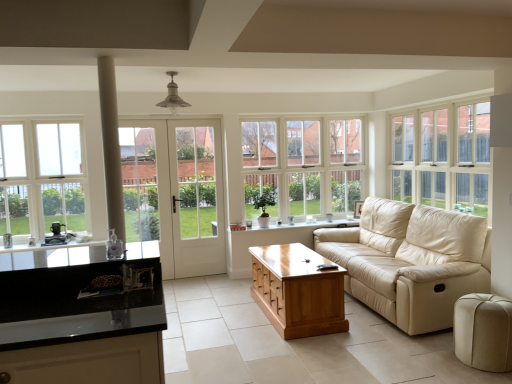
What do you see at coordinates (303, 166) in the screenshot?
I see `white wood window at center, which is the second window from left to right` at bounding box center [303, 166].

Describe the element at coordinates (483, 331) in the screenshot. I see `beige velvet ottoman at lower right` at that location.

The height and width of the screenshot is (384, 512). What do you see at coordinates (443, 157) in the screenshot?
I see `white wood window at upper right, arranged as the third window when viewed from the left` at bounding box center [443, 157].

Locate an element on the screen. This screenshot has height=384, width=512. white wood window at upper right, acting as the 1th window starting from the right is located at coordinates (443, 157).

This screenshot has height=384, width=512. Describe the element at coordinates (53, 257) in the screenshot. I see `black glossy countertop at lower left` at that location.

Locate an element on the screen. white wood window at center, placed as the 2th window when sorted from right to left is located at coordinates (303, 166).

Is beige leather couch at center at the left side of white wood window at center, placed as the 2th window when sorted from right to left?

In fact, beige leather couch at center is to the right of white wood window at center, placed as the 2th window when sorted from right to left.

Is beige leather couch at center positioned far away from white wood window at center, which is the second window from left to right?

Yes.

Which object is wider, beige leather couch at center or white wood window at center, placed as the 2th window when sorted from right to left?

Wider between the two is beige leather couch at center.

Can you tell me how much beige leather couch at center and white wood window at center, which is the second window from left to right, differ in facing direction?

There is a 89.5-degree angle between the facing directions of beige leather couch at center and white wood window at center, which is the second window from left to right.

Which is behind, black glossy countertop at lower left or white glass door at center?

Positioned behind is white glass door at center.

Consider the image. From a real-world perspective, is black glossy countertop at lower left on white glass door at center?

Incorrect, from a real-world perspective, black glossy countertop at lower left is lower than white glass door at center.

Is point (52, 256) closer to viewer compared to point (204, 228)?

That is True.

Looking at this image, considering the sizes of objects shiny brown wooden coffee table at center and black glossy countertop at lower left in the image provided, who is bigger, shiny brown wooden coffee table at center or black glossy countertop at lower left?

Bigger between the two is shiny brown wooden coffee table at center.

From a real-world perspective, relative to black glossy countertop at lower left, is shiny brown wooden coffee table at center vertically above or below?

In terms of real-world spatial position, shiny brown wooden coffee table at center is below black glossy countertop at lower left.

Which is correct: shiny brown wooden coffee table at center is inside black glossy countertop at lower left, or outside of it?

shiny brown wooden coffee table at center exists outside the volume of black glossy countertop at lower left.

Is shiny brown wooden coffee table at center shorter than black glossy countertop at lower left?

Incorrect, the height of shiny brown wooden coffee table at center does not fall short of that of black glossy countertop at lower left.

From the picture: From the image's perspective, is beige velvet ottoman at lower right positioned above or below beige leather couch at center?

beige velvet ottoman at lower right is situated lower than beige leather couch at center in the image.

Is beige velvet ottoman at lower right inside or outside of beige leather couch at center?

beige velvet ottoman at lower right is not enclosed by beige leather couch at center.

Is beige velvet ottoman at lower right with beige leather couch at center?

No.

Can you confirm if white glass door at center is positioned to the right of white wood window at center, which is the second window from left to right?

No, white glass door at center is not to the right of white wood window at center, which is the second window from left to right.

Would you say white wood window at center, which is the second window from left to right, is part of white glass door at center's contents?

No, white wood window at center, which is the second window from left to right, is not inside white glass door at center.

Can you confirm if white glass door at center is bigger than white wood window at center, placed as the 2th window when sorted from right to left?

Actually, white glass door at center might be smaller than white wood window at center, placed as the 2th window when sorted from right to left.

Is white glass door at center facing away from white wood window at center, placed as the 2th window when sorted from right to left?

white glass door at center is not turned away from white wood window at center, placed as the 2th window when sorted from right to left.

Based on the photo, from their relative heights in the image, would you say beige velvet ottoman at lower right is taller or shorter than white wood window at center, which is the second window from left to right?

Considering their sizes, beige velvet ottoman at lower right has less height than white wood window at center, which is the second window from left to right.

Which of these two, beige velvet ottoman at lower right or white wood window at center, placed as the 2th window when sorted from right to left, is smaller?

beige velvet ottoman at lower right is smaller.

Which of these two, beige velvet ottoman at lower right or white wood window at center, placed as the 2th window when sorted from right to left, is thinner?

white wood window at center, placed as the 2th window when sorted from right to left, is thinner.

From the image's perspective, is beige velvet ottoman at lower right above or below white wood window at center, placed as the 2th window when sorted from right to left?

Clearly, from the image's perspective, beige velvet ottoman at lower right is below white wood window at center, placed as the 2th window when sorted from right to left.

Is white wood window at center, placed as the 2th window when sorted from right to left, in contact with white glass door at center?

No.

At what (x,y) coordinates should I click in order to perform the action: click on door that is on the left side of white wood window at center, which is the second window from left to right. Please return your answer as a coordinate pair (x, y). This screenshot has height=384, width=512. Looking at the image, I should click on (175, 192).

Measure the distance from white wood window at center, placed as the 2th window when sorted from right to left, to white glass door at center.

The distance of white wood window at center, placed as the 2th window when sorted from right to left, from white glass door at center is 3.60 feet.

Is white wood window at center, which is the second window from left to right, to the left or to the right of white glass door at center in the image?

white wood window at center, which is the second window from left to right, is positioned on white glass door at center's right side.

This screenshot has width=512, height=384. I want to click on studio couch in front of the white wood window at center, which is the second window from left to right, so click(x=411, y=261).

The image size is (512, 384). I want to click on countertop directly beneath the white glass door at center (from a real-world perspective), so (53, 257).

Considering their positions, is white glass window at left, which ranks as the first window in left-to-right order, positioned further to white wood window at upper right, arranged as the third window when viewed from the left, than beige velvet ottoman at lower right?

white glass window at left, which ranks as the first window in left-to-right order.

Consider the image. Based on their spatial positions, is white glass door at center or shiny brown wooden coffee table at center further from black glossy countertop at lower left?

white glass door at center is positioned further to the anchor black glossy countertop at lower left.

When comparing their distances from white wood window at upper right, acting as the 1th window starting from the right, does white glass door at center or beige velvet ottoman at lower right seem closer?

beige velvet ottoman at lower right.

Looking at the image, which one is located further to beige leather couch at center, white wood window at upper right, arranged as the third window when viewed from the left, or white glass window at left, positioned as the 3th window in right-to-left order?

white glass window at left, positioned as the 3th window in right-to-left order.

Based on the photo, when comparing their distances from beige leather couch at center, does beige velvet ottoman at lower right or shiny brown wooden coffee table at center seem closer?

shiny brown wooden coffee table at center.

Which object lies further to the anchor point shiny brown wooden coffee table at center, beige velvet ottoman at lower right or white wood window at center, placed as the 2th window when sorted from right to left?

Based on the image, white wood window at center, placed as the 2th window when sorted from right to left, appears to be further to shiny brown wooden coffee table at center.

Estimate the real-world distances between objects in this image. Which object is further from white glass window at left, which ranks as the first window in left-to-right order, shiny brown wooden coffee table at center or white glass door at center?

Among the two, shiny brown wooden coffee table at center is located further to white glass window at left, which ranks as the first window in left-to-right order.

Estimate the real-world distances between objects in this image. Which object is closer to white glass window at left, positioned as the 3th window in right-to-left order, beige leather couch at center or black glossy countertop at lower left?

black glossy countertop at lower left is closer to white glass window at left, positioned as the 3th window in right-to-left order.

At what (x,y) coordinates should I click in order to perform the action: click on window between white glass door at center and white wood window at upper right, acting as the 1th window starting from the right. Please return your answer as a coordinate pair (x, y). Looking at the image, I should click on (303, 166).

Image resolution: width=512 pixels, height=384 pixels. Identify the location of armchair located between white glass door at center and white wood window at upper right, arranged as the third window when viewed from the left, in the left-right direction. (483, 331).

The height and width of the screenshot is (384, 512). Find the location of `studio couch between black glossy countertop at lower left and white wood window at upper right, acting as the 1th window starting from the right, from left to right`. studio couch between black glossy countertop at lower left and white wood window at upper right, acting as the 1th window starting from the right, from left to right is located at coordinates (411, 261).

Where is `studio couch between white wood window at upper right, acting as the 1th window starting from the right, and beige velvet ottoman at lower right from top to bottom`? This screenshot has width=512, height=384. studio couch between white wood window at upper right, acting as the 1th window starting from the right, and beige velvet ottoman at lower right from top to bottom is located at coordinates (411, 261).